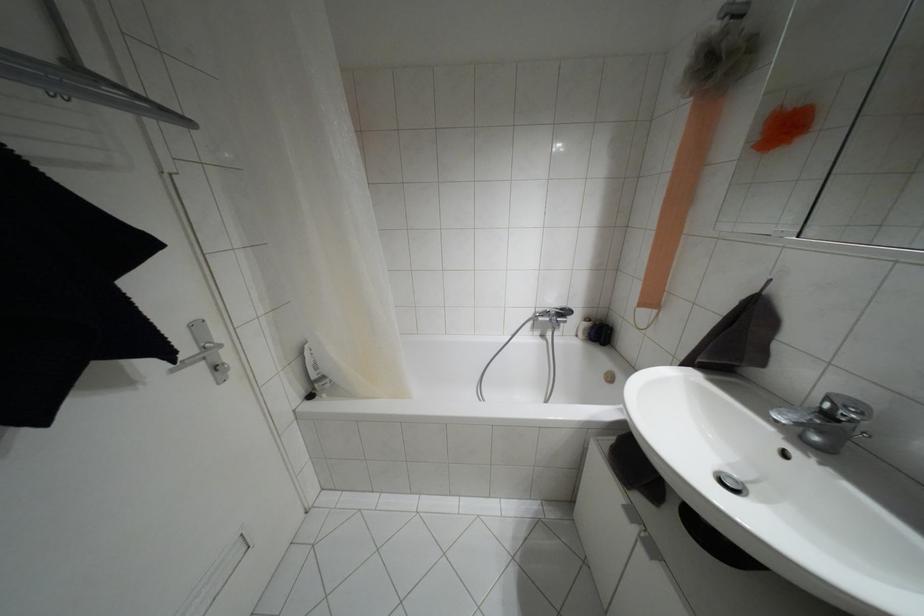
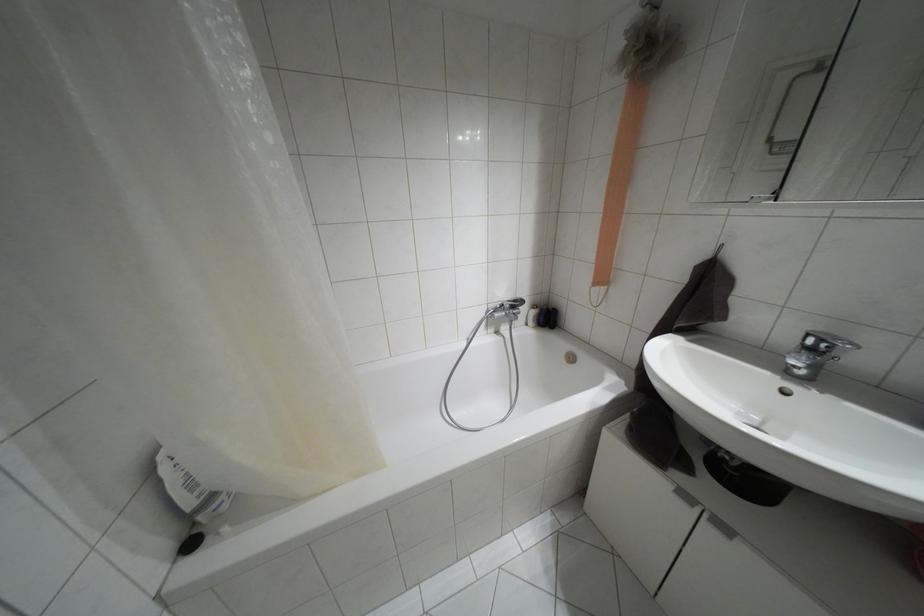
Find the pixel in the second image that matches the point at 651,549 in the first image.

(723, 528)